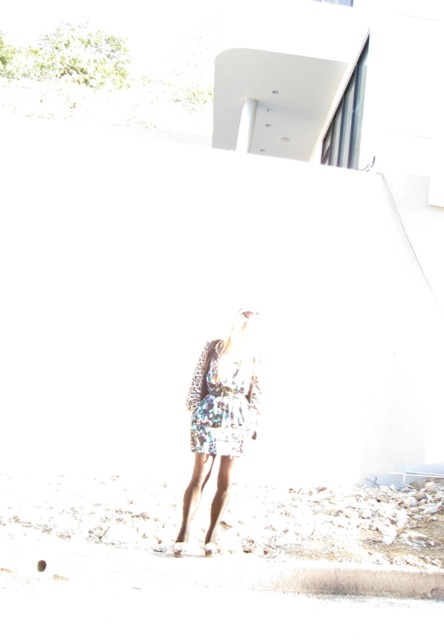
Question: Which object is positioned closest to the floral dress at center?

Choices:
 (A) white sandy beach at lower center
 (B) floral fabric dress at center

Answer: (B)

Question: Which of the following is the farthest from the observer?

Choices:
 (A) white sandy beach at lower center
 (B) floral dress at center
 (C) floral fabric dress at center

Answer: (C)

Question: Does white sandy beach at lower center appear on the right side of floral fabric dress at center?

Choices:
 (A) no
 (B) yes

Answer: (B)

Question: Observing the image, what is the correct spatial positioning of floral dress at center in reference to floral fabric dress at center?

Choices:
 (A) right
 (B) left

Answer: (B)

Question: Is floral dress at center smaller than floral fabric dress at center?

Choices:
 (A) no
 (B) yes

Answer: (A)

Question: Which point is farther to the camera?

Choices:
 (A) (224, 472)
 (B) (161, 534)

Answer: (B)